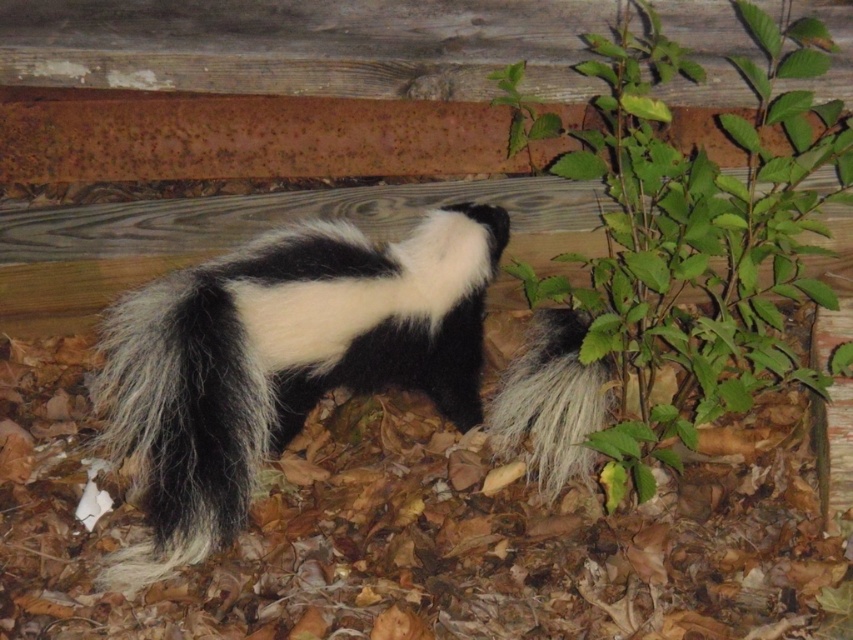
Question: Considering the relative positions of black and white fur skunk at center and green leafy plant at center right in the image provided, where is black and white fur skunk at center located with respect to green leafy plant at center right?

Choices:
 (A) below
 (B) above

Answer: (A)

Question: Which point is closer to the camera taking this photo?

Choices:
 (A) [747, 257]
 (B) [418, 332]

Answer: (A)

Question: Is the position of black and white fur skunk at center less distant than that of green leafy plant at center right?

Choices:
 (A) yes
 (B) no

Answer: (A)

Question: Where is black and white fur skunk at center located in relation to green leafy plant at center right in the image?

Choices:
 (A) left
 (B) right

Answer: (A)

Question: Which object is farther from the camera taking this photo?

Choices:
 (A) green leafy plant at center right
 (B) black and white fur skunk at center

Answer: (A)